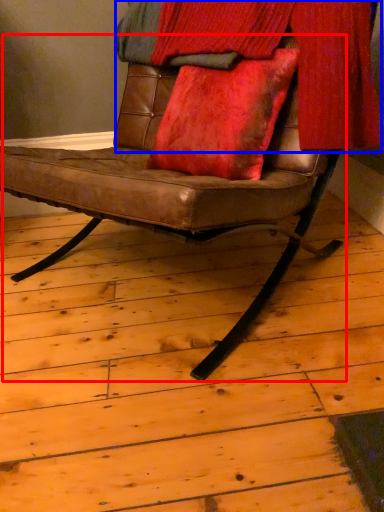
Question: Among these objects, which one is farthest to the camera, chair (highlighted by a red box) or curtain (highlighted by a blue box)?

Choices:
 (A) chair
 (B) curtain

Answer: (B)